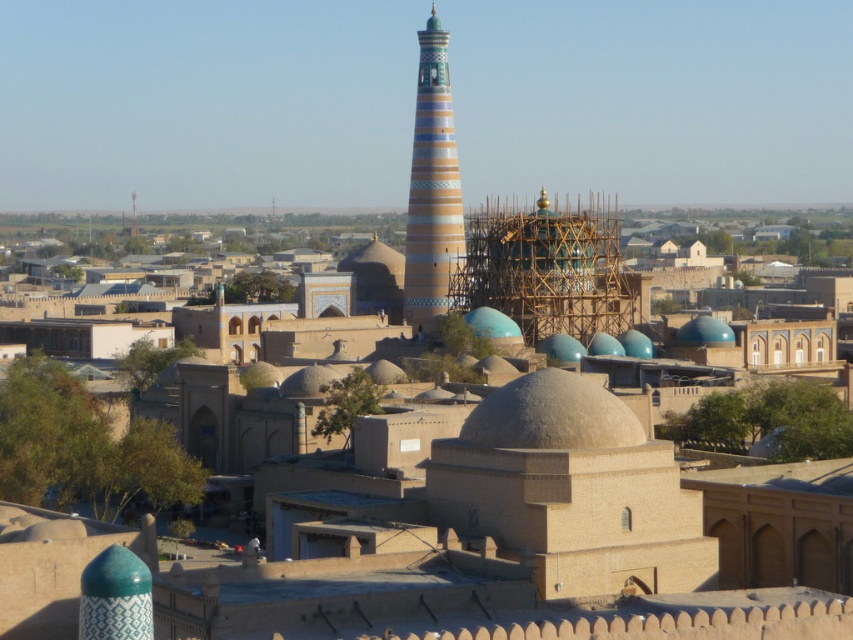
Question: Which point appears closest to the camera in this image?

Choices:
 (A) (442, 257)
 (B) (503, 394)

Answer: (B)

Question: Does multicolored glazed tower at center have a larger size compared to gray textured dome at center?

Choices:
 (A) yes
 (B) no

Answer: (A)

Question: Among these objects, which one is farthest from the camera?

Choices:
 (A) multicolored glazed tower at center
 (B) gray textured dome at center

Answer: (A)

Question: Among these points, which one is farthest from the camera?

Choices:
 (A) 442,166
 (B) 520,404

Answer: (A)

Question: Is multicolored glazed tower at center smaller than gray textured dome at center?

Choices:
 (A) no
 (B) yes

Answer: (A)

Question: Is multicolored glazed tower at center to the right of gray textured dome at center from the viewer's perspective?

Choices:
 (A) no
 (B) yes

Answer: (A)